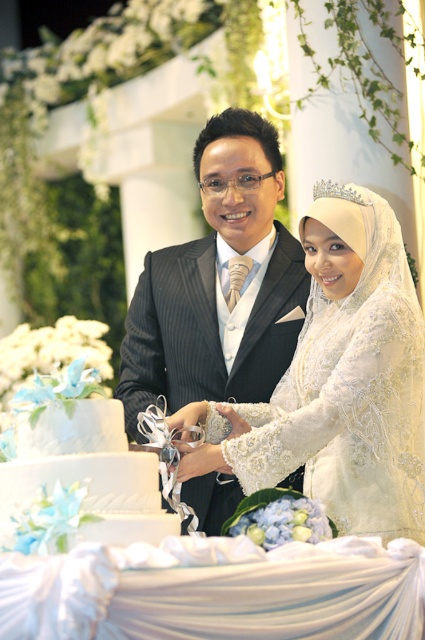
Which is below, white lace dress at center or white textured cake at center?

white textured cake at center is lower down.

Does point (360, 520) come farther from viewer compared to point (39, 513)?

That is True.

The width and height of the screenshot is (425, 640). In order to click on white lace dress at center in this screenshot , I will do `click(350, 385)`.

Which is behind, point (136, 292) or point (30, 413)?

The point (136, 292) is behind.

Is point (161, 371) less distant than point (113, 449)?

No, it is behind (113, 449).

I want to click on matte black suit at center, so click(218, 284).

Is white lace dress at center bigger than matte black suit at center?

Incorrect, white lace dress at center is not larger than matte black suit at center.

Can you confirm if white lace dress at center is smaller than matte black suit at center?

Correct, white lace dress at center occupies less space than matte black suit at center.

You are a GUI agent. You are given a task and a screenshot of the screen. Output one action in this format:
    pyautogui.click(x=<x>, y=<y>)
    Task: Click on the white lace dress at center
    The height and width of the screenshot is (640, 425).
    Given the screenshot: What is the action you would take?
    pyautogui.click(x=350, y=385)

Identify the location of white lace dress at center. The height and width of the screenshot is (640, 425). (350, 385).